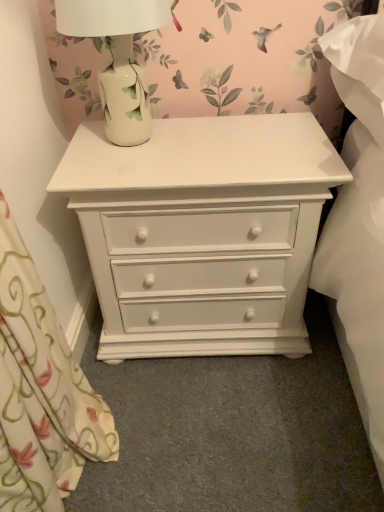
I want to click on vacant area located to the right-hand side of white ceramic lamp at upper left, so click(229, 138).